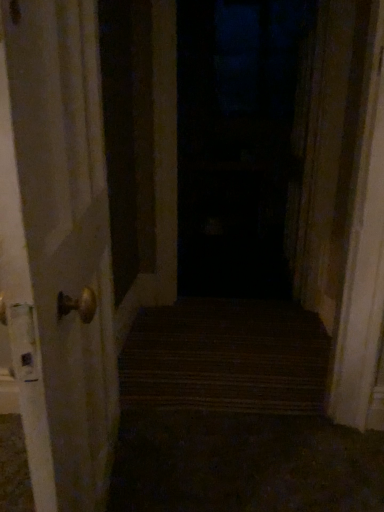
Question: Should I look upward or downward to see matte gold door handle at left?

Choices:
 (A) down
 (B) up

Answer: (A)

Question: Is transparent glass door at center taller than matte gold door handle at left?

Choices:
 (A) no
 (B) yes

Answer: (B)

Question: Can you confirm if transparent glass door at center is smaller than matte gold door handle at left?

Choices:
 (A) yes
 (B) no

Answer: (B)

Question: Is transparent glass door at center not near matte gold door handle at left?

Choices:
 (A) no
 (B) yes

Answer: (B)

Question: Is transparent glass door at center facing away from matte gold door handle at left?

Choices:
 (A) yes
 (B) no

Answer: (B)

Question: From a real-world perspective, is transparent glass door at center over matte gold door handle at left?

Choices:
 (A) no
 (B) yes

Answer: (B)

Question: Is transparent glass door at center thinner than matte gold door handle at left?

Choices:
 (A) no
 (B) yes

Answer: (A)

Question: Can we say matte gold door handle at left lies outside transparent glass door at center?

Choices:
 (A) yes
 (B) no

Answer: (A)

Question: From a real-world perspective, is matte gold door handle at left below transparent glass door at center?

Choices:
 (A) yes
 (B) no

Answer: (A)

Question: Is matte gold door handle at left turned away from transparent glass door at center?

Choices:
 (A) no
 (B) yes

Answer: (A)

Question: Is matte gold door handle at left thinner than transparent glass door at center?

Choices:
 (A) no
 (B) yes

Answer: (B)

Question: From the image's perspective, would you say matte gold door handle at left is shown under transparent glass door at center?

Choices:
 (A) no
 (B) yes

Answer: (B)

Question: From a real-world perspective, is matte gold door handle at left located higher than transparent glass door at center?

Choices:
 (A) yes
 (B) no

Answer: (B)

Question: Which is correct: transparent glass door at center is inside matte gold door handle at left, or outside of it?

Choices:
 (A) inside
 (B) outside

Answer: (B)